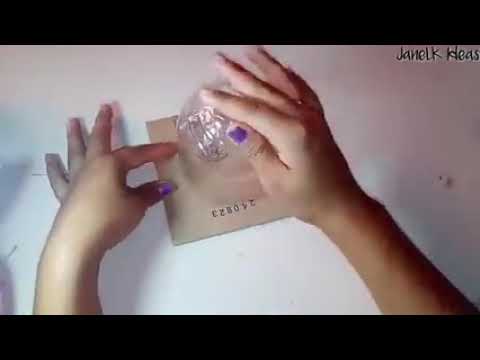
Image resolution: width=480 pixels, height=360 pixels. In order to click on white table in this screenshot , I will do `click(290, 285)`, `click(36, 126)`, `click(142, 61)`, `click(380, 155)`.